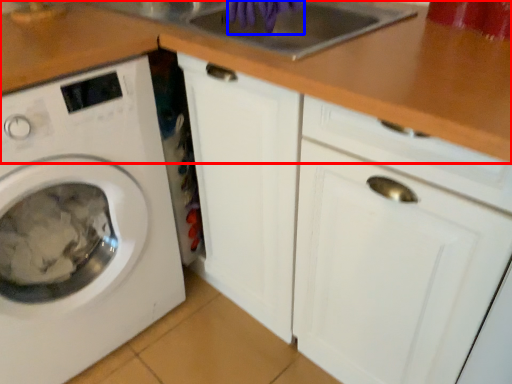
Question: Which point is closer to the camera, counter top (highlighted by a red box) or hand (highlighted by a blue box)?

Choices:
 (A) counter top
 (B) hand

Answer: (A)